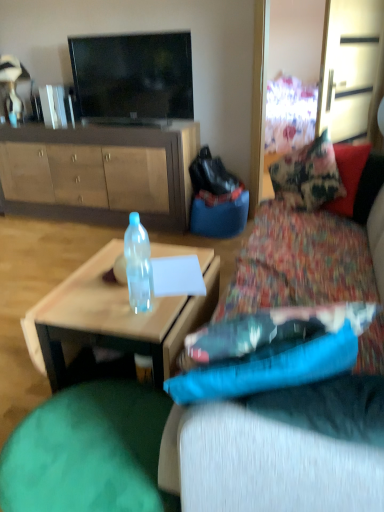
Question: Is green fabric bean bag at lower left to the left of translucent plastic coffee table at center from the viewer's perspective?

Choices:
 (A) no
 (B) yes

Answer: (B)

Question: Would you say green fabric bean bag at lower left is outside translucent plastic coffee table at center?

Choices:
 (A) no
 (B) yes

Answer: (B)

Question: Is green fabric bean bag at lower left bigger than translucent plastic coffee table at center?

Choices:
 (A) no
 (B) yes

Answer: (A)

Question: Considering the relative sizes of green fabric bean bag at lower left and translucent plastic coffee table at center in the image provided, is green fabric bean bag at lower left thinner than translucent plastic coffee table at center?

Choices:
 (A) no
 (B) yes

Answer: (B)

Question: Is green fabric bean bag at lower left far from translucent plastic coffee table at center?

Choices:
 (A) no
 (B) yes

Answer: (A)

Question: From the image's perspective, is textured fabric couch at center located above or below matte brown cabinet at center?

Choices:
 (A) above
 (B) below

Answer: (B)

Question: Is textured fabric couch at center in front of or behind matte brown cabinet at center in the image?

Choices:
 (A) front
 (B) behind

Answer: (A)

Question: From a real-world perspective, is textured fabric couch at center positioned above or below matte brown cabinet at center?

Choices:
 (A) above
 (B) below

Answer: (A)

Question: Looking at the image, does textured fabric couch at center seem bigger or smaller compared to matte brown cabinet at center?

Choices:
 (A) small
 (B) big

Answer: (A)

Question: Based on their positions, is translucent plastic coffee table at center located to the left or right of flat screen tv at upper center?

Choices:
 (A) left
 (B) right

Answer: (B)

Question: Is translucent plastic coffee table at center situated inside flat screen tv at upper center or outside?

Choices:
 (A) inside
 (B) outside

Answer: (B)

Question: In terms of height, does translucent plastic coffee table at center look taller or shorter compared to flat screen tv at upper center?

Choices:
 (A) short
 (B) tall

Answer: (A)

Question: From the image's perspective, relative to flat screen tv at upper center, is translucent plastic coffee table at center above or below?

Choices:
 (A) below
 (B) above

Answer: (A)

Question: From a real-world perspective, is matte brown cabinet at center positioned above or below flat screen tv at upper center?

Choices:
 (A) below
 (B) above

Answer: (A)

Question: Does point (61, 210) appear closer or farther from the camera than point (185, 113)?

Choices:
 (A) farther
 (B) closer

Answer: (A)